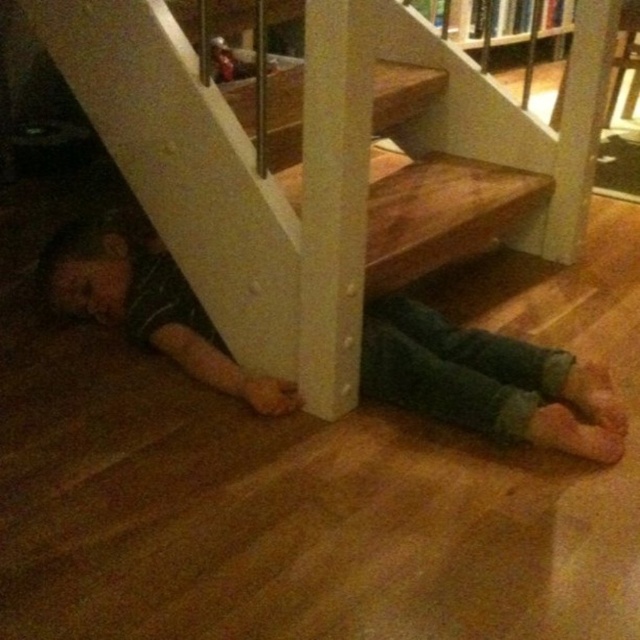
Can you confirm if wooden at lower left is shorter than green denim pants at lower left?

Incorrect, wooden at lower left's height does not fall short of green denim pants at lower left's.

Who is more forward, (540,170) or (529,353)?

Point (529,353)

Where is `wooden at lower left`? wooden at lower left is located at coordinates (305, 170).